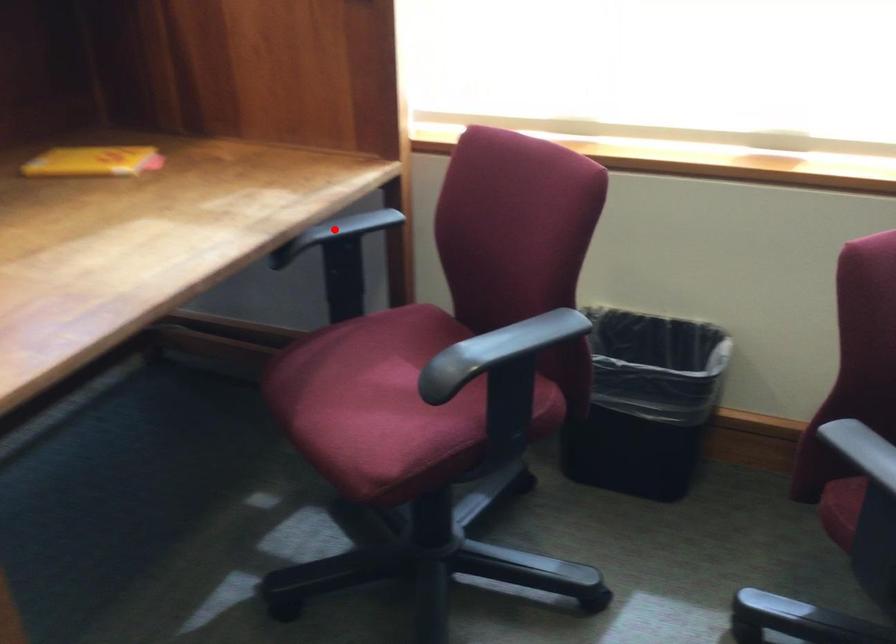
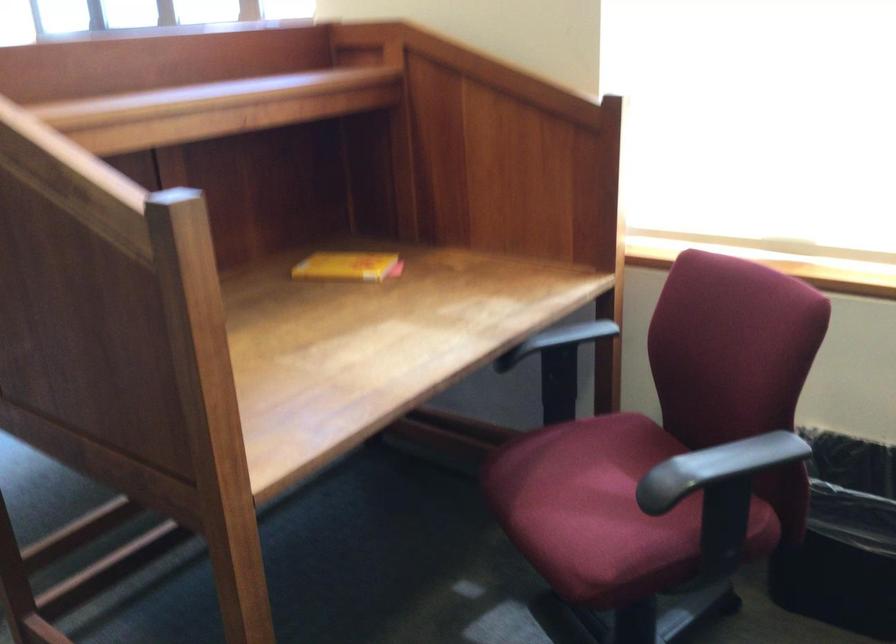
The point at the highlighted location is marked in the first image. Where is the corresponding point in the second image?

(556, 339)